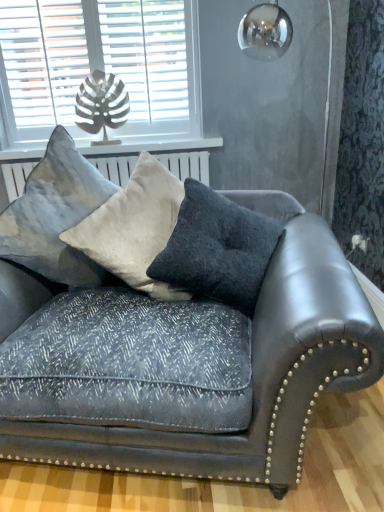
Question: Is white painted wood at upper left to the right of white wooden blinds at upper left from the viewer's perspective?

Choices:
 (A) no
 (B) yes

Answer: (B)

Question: Considering the relative sizes of white painted wood at upper left and white wooden blinds at upper left in the image provided, is white painted wood at upper left shorter than white wooden blinds at upper left?

Choices:
 (A) yes
 (B) no

Answer: (A)

Question: Is the position of white painted wood at upper left less distant than that of white wooden blinds at upper left?

Choices:
 (A) no
 (B) yes

Answer: (A)

Question: Considering the relative sizes of white painted wood at upper left and white wooden blinds at upper left in the image provided, is white painted wood at upper left smaller than white wooden blinds at upper left?

Choices:
 (A) no
 (B) yes

Answer: (B)

Question: Would you say white painted wood at upper left is outside white wooden blinds at upper left?

Choices:
 (A) yes
 (B) no

Answer: (A)

Question: Is velvet dark gray couch at center taller or shorter than textured velvet pillow at center, the 2th pillow viewed from the left?

Choices:
 (A) short
 (B) tall

Answer: (B)

Question: Relative to textured velvet pillow at center, the 2th pillow viewed from the left, is velvet dark gray couch at center in front or behind?

Choices:
 (A) behind
 (B) front

Answer: (B)

Question: From the image's perspective, is velvet dark gray couch at center above or below textured velvet pillow at center, the 2th pillow from the right?

Choices:
 (A) above
 (B) below

Answer: (B)

Question: Looking at their shapes, would you say velvet dark gray couch at center is wider or thinner than textured velvet pillow at center, the 2th pillow from the right?

Choices:
 (A) thin
 (B) wide

Answer: (B)

Question: From the image's perspective, is white painted wood at upper left positioned above or below white wooden blinds at upper left?

Choices:
 (A) below
 (B) above

Answer: (A)

Question: In terms of width, does white painted wood at upper left look wider or thinner when compared to white wooden blinds at upper left?

Choices:
 (A) wide
 (B) thin

Answer: (A)

Question: Considering the relative positions of white painted wood at upper left and white wooden blinds at upper left in the image provided, is white painted wood at upper left to the left or to the right of white wooden blinds at upper left?

Choices:
 (A) right
 (B) left

Answer: (A)

Question: Would you say white painted wood at upper left is inside or outside white wooden blinds at upper left?

Choices:
 (A) outside
 (B) inside

Answer: (A)

Question: Is point (170, 34) positioned closer to the camera than point (0, 155)?

Choices:
 (A) farther
 (B) closer

Answer: (B)

Question: In terms of size, does white wooden blinds at upper left appear bigger or smaller than white painted wood at upper left?

Choices:
 (A) big
 (B) small

Answer: (A)